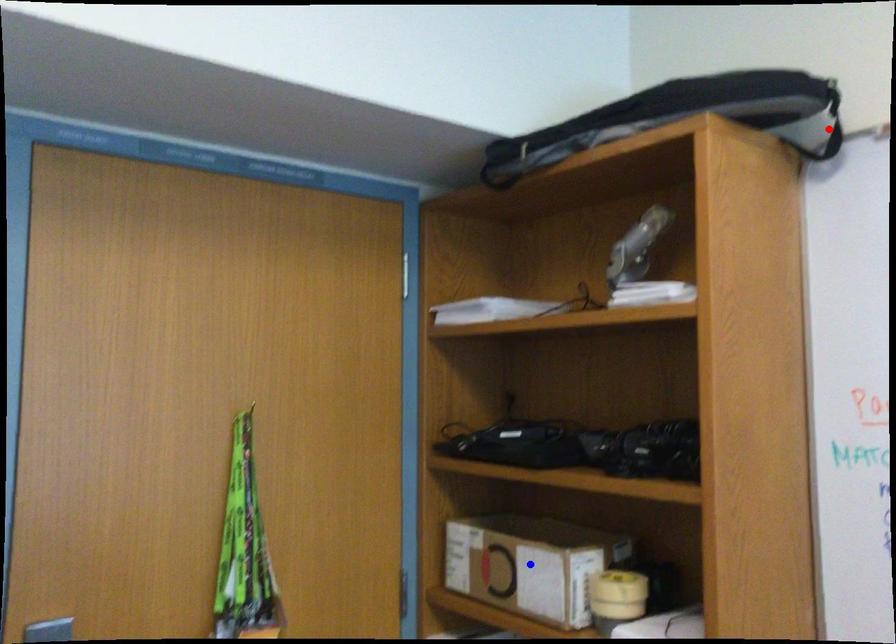
Question: Two points are marked on the image. Which point is closer to the camera?

Choices:
 (A) Blue point is closer.
 (B) Red point is closer.

Answer: (B)